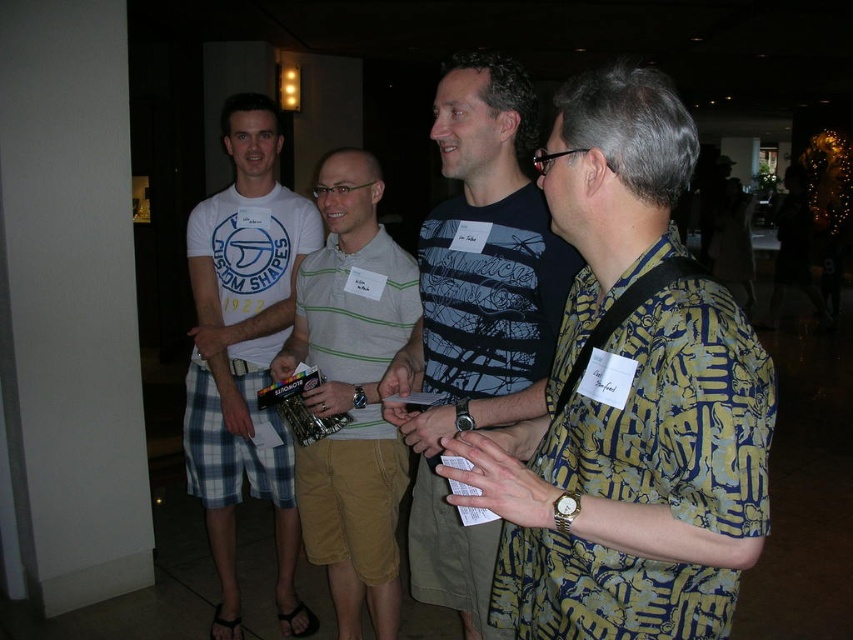
You are standing in the room and want to reach the point marked as point (524, 273). If your walking speed is 3 feet per second, how many seconds will it take you to reach that point?

The distance between you and point (524, 273) is 5.36 feet. At a speed of 3 feet per second, it will take approximately 1.79 seconds to reach the point.

You are at a networking event and want to approach the yellow printed shirt at center and the dark blue striped shirt at center. Which one should you walk towards first to reach the one closer to you?

You should first approach the yellow printed shirt at center because it is closer to the viewer than the dark blue striped shirt at center.